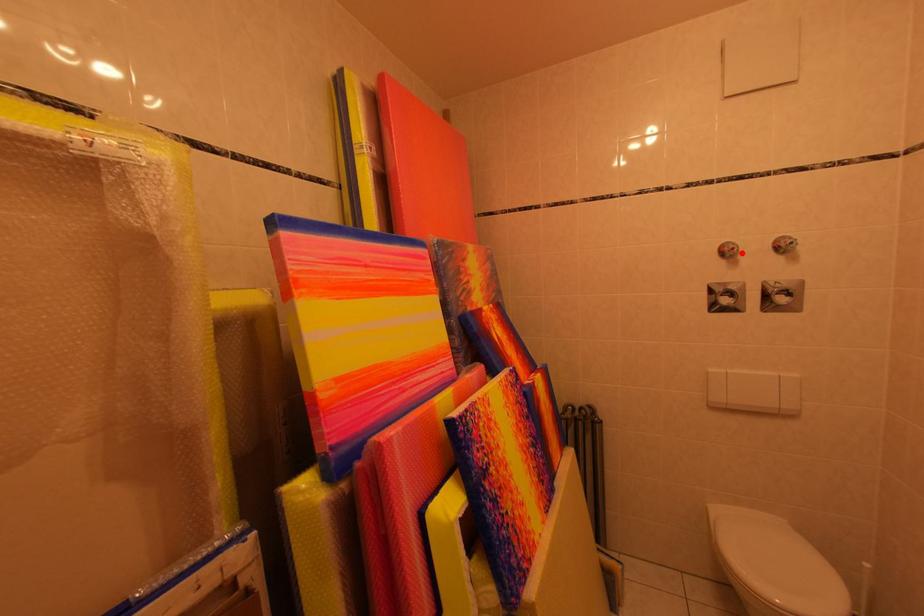
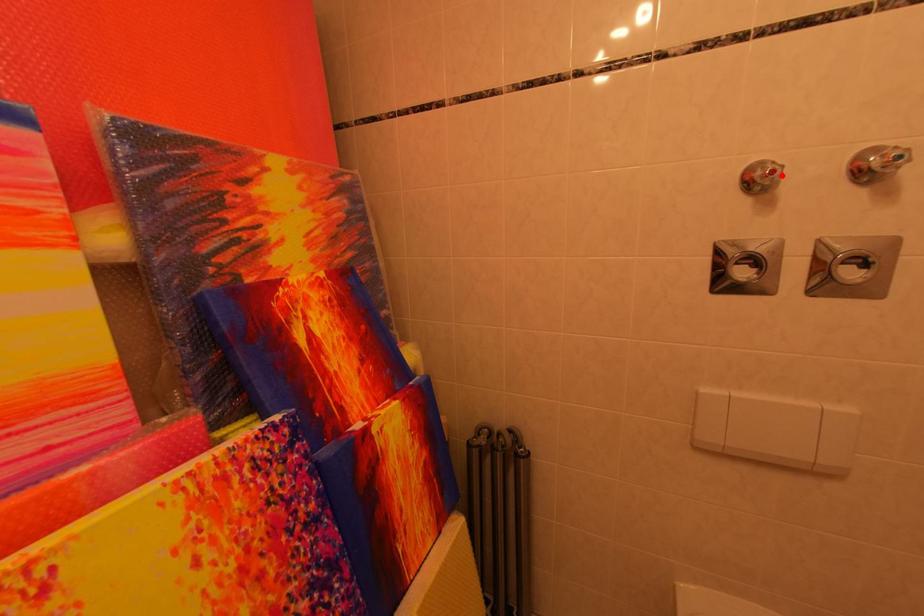
I am providing you with two images of the same scene from different viewpoints. A red point is marked on the first image and another point is marked on the second image. Do the highlighted points in image1 and image2 indicate the same real-world spot?

Yes